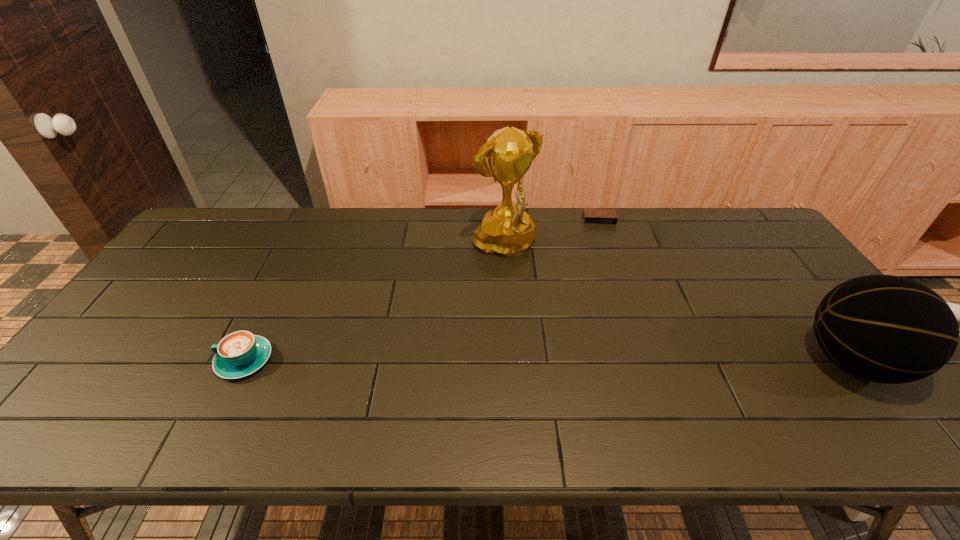
Identify the location of cappuccino. This screenshot has width=960, height=540. (241, 353).

Where is `the leftmost object`? The image size is (960, 540). the leftmost object is located at coordinates (241, 353).

Where is `the second tallest object`? Image resolution: width=960 pixels, height=540 pixels. the second tallest object is located at coordinates (888, 329).

Image resolution: width=960 pixels, height=540 pixels. Find the location of `basketball`. basketball is located at coordinates (888, 329).

Locate an element on the screen. The width and height of the screenshot is (960, 540). the tallest object is located at coordinates (508, 230).

Where is `the second object from left to right`? This screenshot has height=540, width=960. the second object from left to right is located at coordinates (508, 230).

Find the location of a particular element. alarm clock is located at coordinates (590, 215).

The width and height of the screenshot is (960, 540). What are the coordinates of `the third object from left to right` in the screenshot? It's located at (590, 215).

This screenshot has height=540, width=960. In order to click on free spot located 0.090m with the handle on the right side of the cappuccino in this screenshot , I will do `click(181, 360)`.

Identify the location of vacant space situated 0.330m with the handle on the right side of the cappuccino. (84, 360).